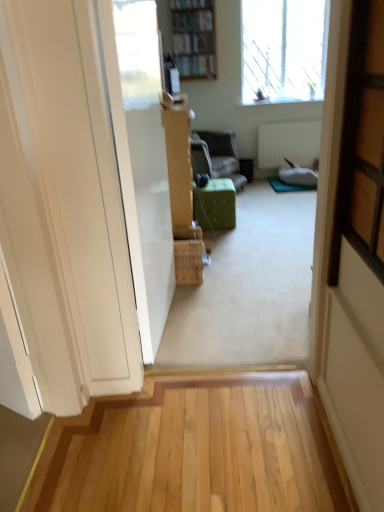
Describe the element at coordinates (216, 156) in the screenshot. The height and width of the screenshot is (512, 384). I see `green fabric ottoman at center, which is the second furniture from front to back` at that location.

The height and width of the screenshot is (512, 384). What are the coordinates of `wooden bookshelf at upper center` in the screenshot? It's located at (193, 37).

Measure the distance between green fabric ottoman at center, marked as the first furniture in a bottom-to-top arrangement, and camera.

green fabric ottoman at center, marked as the first furniture in a bottom-to-top arrangement, is 11.71 feet from camera.

Locate an element on the screen. This screenshot has height=512, width=384. green fabric ottoman at center, marked as the first furniture in a bottom-to-top arrangement is located at coordinates coord(215,204).

This screenshot has height=512, width=384. In order to click on green fabric ottoman at center, arranged as the 1th furniture when viewed from the back in this screenshot , I will do point(216,156).

From a real-world perspective, is transparent glass window at upper right positioned above or below wooden bookshelf at upper center?

transparent glass window at upper right is situated lower than wooden bookshelf at upper center in the real world.

Is transparent glass window at upper right situated inside wooden bookshelf at upper center or outside?

transparent glass window at upper right is not enclosed by wooden bookshelf at upper center.

Can you confirm if transparent glass window at upper right is shorter than wooden bookshelf at upper center?

In fact, transparent glass window at upper right may be taller than wooden bookshelf at upper center.

From the picture: Visually, is transparent glass window at upper right positioned to the left or to the right of wooden bookshelf at upper center?

Based on their positions, transparent glass window at upper right is located to the right of wooden bookshelf at upper center.

Which of these two, transparent glass window at upper right or green fabric ottoman at center, marked as the first furniture in a bottom-to-top arrangement, is bigger?

transparent glass window at upper right is bigger.

Can you confirm if transparent glass window at upper right is taller than green fabric ottoman at center, the 2th furniture from the top?

Indeed, transparent glass window at upper right has a greater height compared to green fabric ottoman at center, the 2th furniture from the top.

Is transparent glass window at upper right inside the boundaries of green fabric ottoman at center, the first furniture in the front-to-back sequence, or outside?

transparent glass window at upper right exists outside the volume of green fabric ottoman at center, the first furniture in the front-to-back sequence.

Where is `the 1st furniture in front of the wooden bookshelf at upper center, counting from the anchor's position`? This screenshot has width=384, height=512. the 1st furniture in front of the wooden bookshelf at upper center, counting from the anchor's position is located at coordinates (216, 156).

Based on the photo, which of these two, wooden bookshelf at upper center or green fabric ottoman at center, arranged as the 1th furniture when viewed from the back, is wider?

green fabric ottoman at center, arranged as the 1th furniture when viewed from the back, is wider.

Which is further, (188, 34) or (231, 157)?

The point (231, 157) is behind.

Between wooden bookshelf at upper center and green fabric ottoman at center, arranged as the 1th furniture when viewed from the back, which one appears on the left side from the viewer's perspective?

Positioned to the left is wooden bookshelf at upper center.

Is green fabric ottoman at center, the first furniture in the front-to-back sequence, far from transparent glass window at upper right?

Yes.

Is green fabric ottoman at center, the 2th furniture from the top, to the left of transparent glass window at upper right from the viewer's perspective?

Correct, you'll find green fabric ottoman at center, the 2th furniture from the top, to the left of transparent glass window at upper right.

From a real-world perspective, which is physically above, green fabric ottoman at center, the first furniture in the front-to-back sequence, or transparent glass window at upper right?

From a 3D spatial view, transparent glass window at upper right is above.

Is transparent glass window at upper right inside green fabric ottoman at center, the 2th furniture from the top?

Definitely not — transparent glass window at upper right is not inside green fabric ottoman at center, the 2th furniture from the top.

Can you confirm if transparent glass window at upper right is positioned to the right of green fabric ottoman at center, acting as the second furniture starting from the bottom?

Indeed, transparent glass window at upper right is positioned on the right side of green fabric ottoman at center, acting as the second furniture starting from the bottom.

Is transparent glass window at upper right facing towards green fabric ottoman at center, which is the 1th furniture from top to bottom?

No, transparent glass window at upper right is not oriented towards green fabric ottoman at center, which is the 1th furniture from top to bottom.

There is a green fabric ottoman at center, arranged as the 1th furniture when viewed from the back. In order to click on window above it (from a real-world perspective) in this screenshot , I will do `click(284, 50)`.

Identify the location of furniture below the green fabric ottoman at center, arranged as the 1th furniture when viewed from the back (from the image's perspective). This screenshot has width=384, height=512. (215, 204).

From the image's perspective, would you say green fabric ottoman at center, marked as the first furniture in a bottom-to-top arrangement, is positioned over green fabric ottoman at center, which is the 1th furniture from top to bottom?

No.

Relative to green fabric ottoman at center, arranged as the 1th furniture when viewed from the back, is green fabric ottoman at center, the 2th furniture from the top, in front or behind?

Visually, green fabric ottoman at center, the 2th furniture from the top, is located in front of green fabric ottoman at center, arranged as the 1th furniture when viewed from the back.

Which is less distant, (235, 197) or (201, 150)?

Point (235, 197)

Choose the correct answer: Is green fabric ottoman at center, which is the second furniture from front to back, inside transparent glass window at upper right or outside it?

green fabric ottoman at center, which is the second furniture from front to back, is not enclosed by transparent glass window at upper right.

Is green fabric ottoman at center, acting as the second furniture starting from the bottom, turned away from transparent glass window at upper right?

That's not correct — green fabric ottoman at center, acting as the second furniture starting from the bottom, is not looking away from transparent glass window at upper right.

From a real-world perspective, which is physically below, green fabric ottoman at center, arranged as the 1th furniture when viewed from the back, or transparent glass window at upper right?

green fabric ottoman at center, arranged as the 1th furniture when viewed from the back, is physically lower.

The image size is (384, 512). In order to click on bookcase below the transparent glass window at upper right (from the image's perspective) in this screenshot , I will do `click(193, 37)`.

At what (x,y) coordinates should I click in order to perform the action: click on window behind the green fabric ottoman at center, marked as the first furniture in a bottom-to-top arrangement. Please return your answer as a coordinate pair (x, y). Looking at the image, I should click on pos(284,50).

Based on their spatial positions, is wooden bookshelf at upper center or transparent glass window at upper right closer to green fabric ottoman at center, which is the second furniture from front to back?

wooden bookshelf at upper center is closer to green fabric ottoman at center, which is the second furniture from front to back.

Considering their positions, is green fabric ottoman at center, marked as the first furniture in a bottom-to-top arrangement, positioned closer to transparent glass window at upper right than green fabric ottoman at center, acting as the second furniture starting from the bottom?

Among the two, green fabric ottoman at center, acting as the second furniture starting from the bottom, is located nearer to transparent glass window at upper right.

In the scene shown: When comparing their distances from transparent glass window at upper right, does green fabric ottoman at center, arranged as the 1th furniture when viewed from the back, or green fabric ottoman at center, the 2th furniture from the top, seem further?

Based on the image, green fabric ottoman at center, the 2th furniture from the top, appears to be further to transparent glass window at upper right.

Based on their spatial positions, is transparent glass window at upper right or green fabric ottoman at center, acting as the second furniture starting from the bottom, further from wooden bookshelf at upper center?

Among the two, transparent glass window at upper right is located further to wooden bookshelf at upper center.

Which object lies further to the anchor point wooden bookshelf at upper center, green fabric ottoman at center, acting as the second furniture starting from the bottom, or green fabric ottoman at center, the second furniture from the back?

green fabric ottoman at center, the second furniture from the back, is positioned further to the anchor wooden bookshelf at upper center.

When comparing their distances from green fabric ottoman at center, the 2th furniture from the top, does transparent glass window at upper right or green fabric ottoman at center, which is the second furniture from front to back, seem further?

transparent glass window at upper right is further to green fabric ottoman at center, the 2th furniture from the top.

Considering their positions, is wooden bookshelf at upper center positioned further to transparent glass window at upper right than green fabric ottoman at center, which is the second furniture from front to back?

green fabric ottoman at center, which is the second furniture from front to back, lies further to transparent glass window at upper right than the other object.

In the scene shown: When comparing their distances from wooden bookshelf at upper center, does green fabric ottoman at center, marked as the first furniture in a bottom-to-top arrangement, or transparent glass window at upper right seem further?

green fabric ottoman at center, marked as the first furniture in a bottom-to-top arrangement, is positioned further to the anchor wooden bookshelf at upper center.

Find the location of a particular element. This screenshot has width=384, height=512. furniture between wooden bookshelf at upper center and green fabric ottoman at center, marked as the first furniture in a bottom-to-top arrangement, vertically is located at coordinates (216, 156).

The width and height of the screenshot is (384, 512). I want to click on bookcase between transparent glass window at upper right and green fabric ottoman at center, marked as the first furniture in a bottom-to-top arrangement, in the up-down direction, so click(x=193, y=37).

Locate an element on the screen. The image size is (384, 512). furniture between transparent glass window at upper right and green fabric ottoman at center, the second furniture from the back, vertically is located at coordinates click(x=216, y=156).

You are a GUI agent. You are given a task and a screenshot of the screen. Output one action in this format:
    pyautogui.click(x=<x>, y=<y>)
    Task: Click on the bookcase between transparent glass window at upper right and green fabric ottoman at center, acting as the second furniture starting from the bottom, vertically
    This screenshot has height=512, width=384.
    Given the screenshot: What is the action you would take?
    pyautogui.click(x=193, y=37)